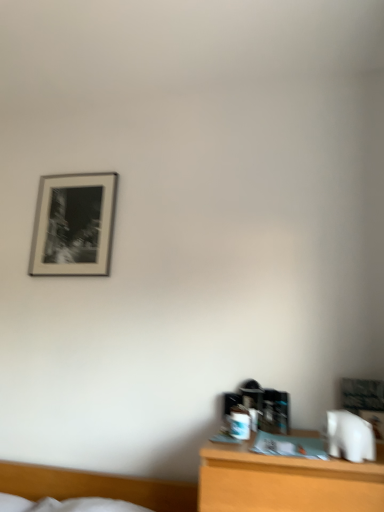
Image resolution: width=384 pixels, height=512 pixels. What do you see at coordinates (96, 486) in the screenshot?
I see `white soft bed at lower left` at bounding box center [96, 486].

Find the location of a particular element. The width and height of the screenshot is (384, 512). white soft bed at lower left is located at coordinates (96, 486).

The image size is (384, 512). Identify the location of silver metallic picture frame at upper left. (73, 225).

What do you see at coordinates (73, 225) in the screenshot? Image resolution: width=384 pixels, height=512 pixels. I see `silver metallic picture frame at upper left` at bounding box center [73, 225].

You are a GUI agent. You are given a task and a screenshot of the screen. Output one action in this format:
    pyautogui.click(x=<x>, y=<y>)
    Task: Click on the white soft bed at lower left
    The height and width of the screenshot is (512, 384).
    Given the screenshot: What is the action you would take?
    pyautogui.click(x=96, y=486)

Is white soft bed at lower left to the left or to the right of silver metallic picture frame at upper left in the image?

white soft bed at lower left is positioned on silver metallic picture frame at upper left's right side.

In the image, is white soft bed at lower left positioned in front of or behind silver metallic picture frame at upper left?

In the image, white soft bed at lower left appears in front of silver metallic picture frame at upper left.

Is point (17, 478) positioned in front of point (53, 194)?

Yes, point (17, 478) is in front of point (53, 194).

From the image's perspective, is white soft bed at lower left located beneath silver metallic picture frame at upper left?

Indeed, from the image's perspective, white soft bed at lower left is shown beneath silver metallic picture frame at upper left.

From a real-world perspective, is white soft bed at lower left positioned above or below silver metallic picture frame at upper left?

From a real-world perspective, white soft bed at lower left is physically below silver metallic picture frame at upper left.

Between white soft bed at lower left and silver metallic picture frame at upper left, which one has smaller width?

silver metallic picture frame at upper left is thinner.

Considering the sizes of objects white soft bed at lower left and silver metallic picture frame at upper left in the image provided, who is shorter, white soft bed at lower left or silver metallic picture frame at upper left?

white soft bed at lower left.

Considering the relative sizes of white soft bed at lower left and silver metallic picture frame at upper left in the image provided, is white soft bed at lower left bigger than silver metallic picture frame at upper left?

Correct, white soft bed at lower left is larger in size than silver metallic picture frame at upper left.

Is silver metallic picture frame at upper left completely or partially inside white soft bed at lower left?

No, silver metallic picture frame at upper left is located outside of white soft bed at lower left.

Based on the photo, is white soft bed at lower left in contact with silver metallic picture frame at upper left?

They are not placed beside each other.

Is white soft bed at lower left aimed at silver metallic picture frame at upper left?

No, white soft bed at lower left is not turned towards silver metallic picture frame at upper left.

How different are the orientations of white soft bed at lower left and silver metallic picture frame at upper left in degrees?

They differ by 0.333 degrees in their facing directions.

Find the location of a particular element. Image resolution: width=384 pixels, height=512 pixels. picture frame behind the white soft bed at lower left is located at coordinates (73, 225).

Is silver metallic picture frame at upper left at the right side of white soft bed at lower left?

Incorrect, silver metallic picture frame at upper left is not on the right side of white soft bed at lower left.

Which object is further away from the camera taking this photo, silver metallic picture frame at upper left or white soft bed at lower left?

silver metallic picture frame at upper left is further away from the camera.

Considering the points (73, 194) and (4, 489), which point is in front, point (73, 194) or point (4, 489)?

The point (4, 489) is closer to the camera.

From the image's perspective, does silver metallic picture frame at upper left appear lower than white soft bed at lower left?

Actually, silver metallic picture frame at upper left appears above white soft bed at lower left in the image.

From a real-world perspective, is silver metallic picture frame at upper left above or below white soft bed at lower left?

In terms of real-world spatial position, silver metallic picture frame at upper left is above white soft bed at lower left.

Is silver metallic picture frame at upper left wider or thinner than white soft bed at lower left?

Considering their sizes, silver metallic picture frame at upper left looks slimmer than white soft bed at lower left.

Who is shorter, silver metallic picture frame at upper left or white soft bed at lower left?

With less height is white soft bed at lower left.

Looking at this image, looking at the image, does silver metallic picture frame at upper left seem bigger or smaller compared to white soft bed at lower left?

silver metallic picture frame at upper left is smaller than white soft bed at lower left.

Based on the photo, is silver metallic picture frame at upper left spatially inside white soft bed at lower left, or outside of it?

silver metallic picture frame at upper left lies outside white soft bed at lower left.

Is silver metallic picture frame at upper left far away from white soft bed at lower left?

Yes, silver metallic picture frame at upper left and white soft bed at lower left are located far from each other.

Is silver metallic picture frame at upper left oriented towards white soft bed at lower left?

No, silver metallic picture frame at upper left is not facing towards white soft bed at lower left.

The width and height of the screenshot is (384, 512). What are the coordinates of `picture frame located above the white soft bed at lower left (from the image's perspective)` in the screenshot? It's located at (73, 225).

The image size is (384, 512). In the image, there is a white soft bed at lower left. Find the location of `picture frame above it (from the image's perspective)`. picture frame above it (from the image's perspective) is located at coordinates (73, 225).

Identify the location of bed below the silver metallic picture frame at upper left (from the image's perspective). Image resolution: width=384 pixels, height=512 pixels. (96, 486).